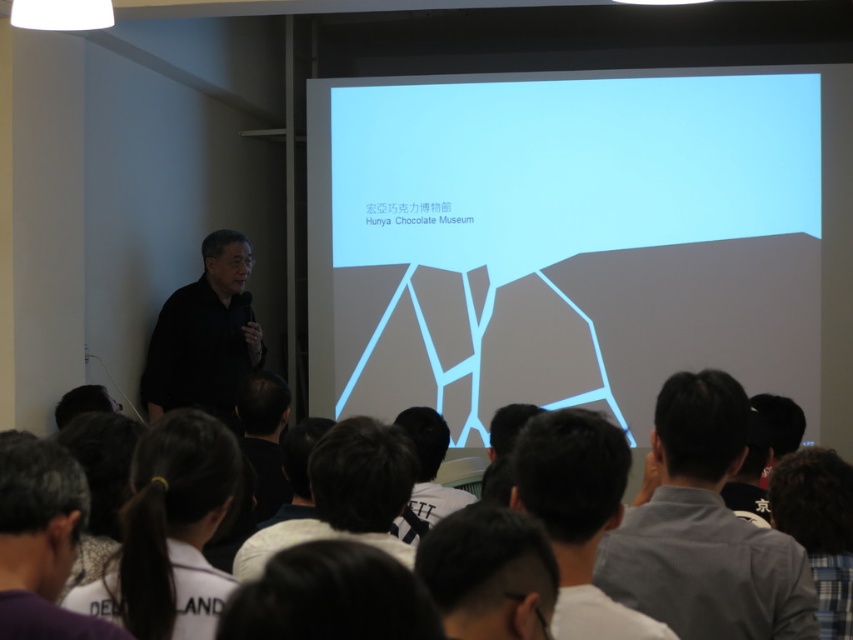
Question: Is dark gray shirt at lower right to the left of white fabric ponytail at lower center from the viewer's perspective?

Choices:
 (A) no
 (B) yes

Answer: (A)

Question: Which object is the farthest from the black matte shirt at left?

Choices:
 (A) dark gray hair at lower center
 (B) white fabric ponytail at lower center
 (C) dark brown hair at lower center
 (D) dark gray shirt at center

Answer: (C)

Question: Where is dark gray shirt at lower right located in relation to dark brown hair at lower center in the image?

Choices:
 (A) above
 (B) below

Answer: (B)

Question: Does dark gray hair at lower center appear on the left side of dark brown hair at lower right?

Choices:
 (A) no
 (B) yes

Answer: (B)

Question: Estimate the real-world distances between objects in this image. Which object is closer to the white fabric ponytail at lower center?

Choices:
 (A) white matte shirt at center
 (B) black matte shirt at left

Answer: (A)

Question: Which object is farther from the camera taking this photo?

Choices:
 (A) white matte shirt at center
 (B) white fabric ponytail at lower center
 (C) dark gray hair at lower center

Answer: (A)